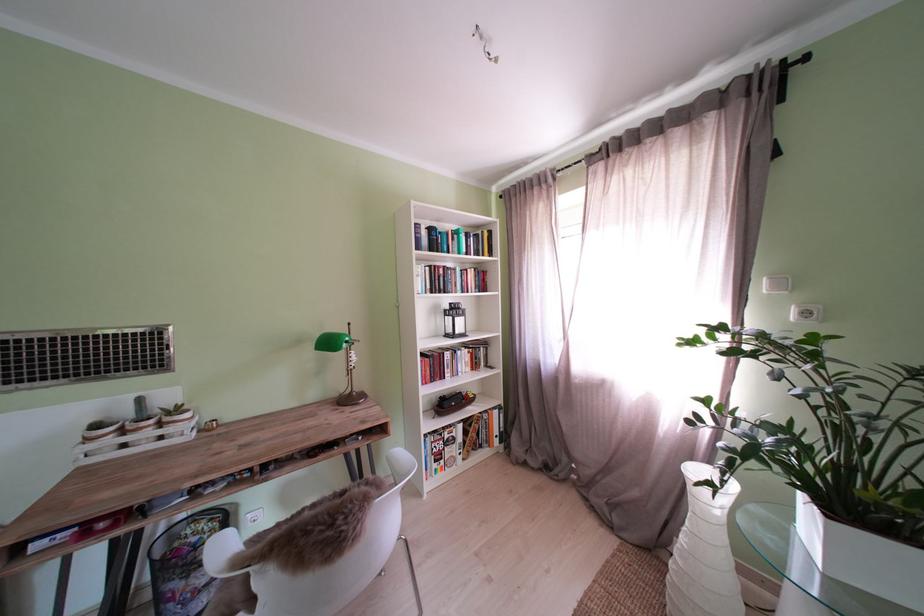
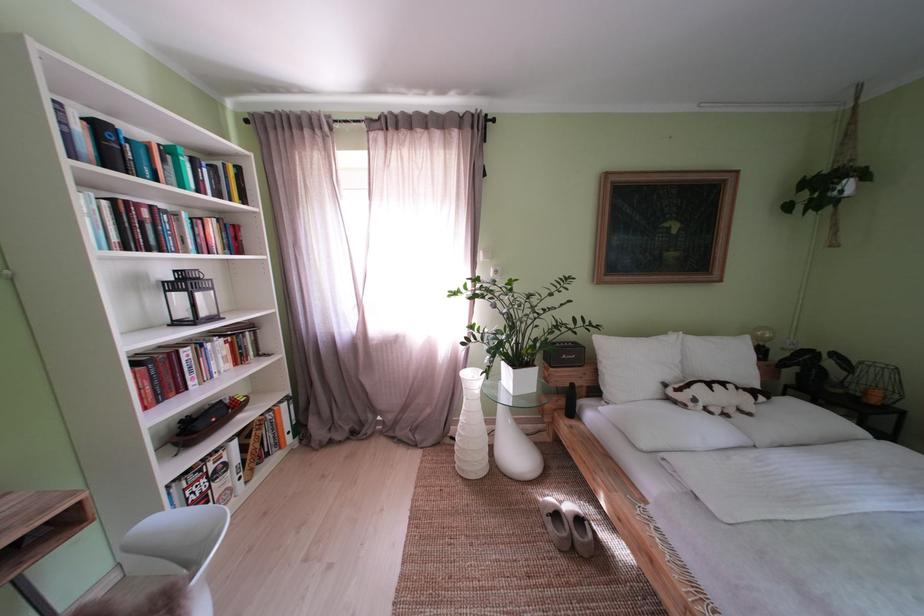
Where in the second image is the point corresponding to point 458,361 from the first image?

(199, 359)